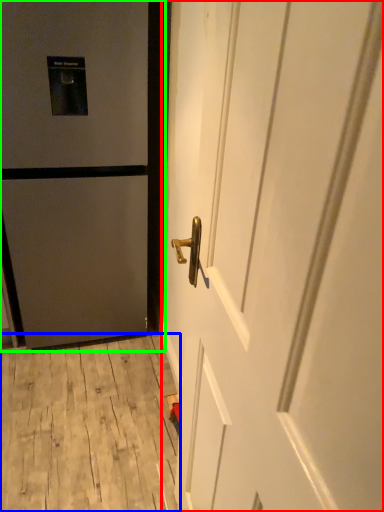
Question: Considering the real-world distances, which object is closest to door (highlighted by a red box)? plywood (highlighted by a blue box) or door (highlighted by a green box).

Choices:
 (A) plywood
 (B) door

Answer: (B)